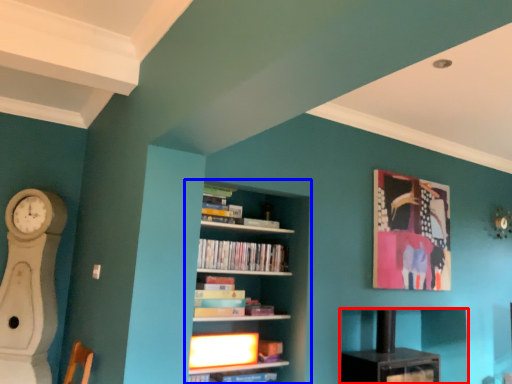
Question: Which point is closer to the camera, shelf (highlighted by a red box) or bookcase (highlighted by a blue box)?

Choices:
 (A) shelf
 (B) bookcase

Answer: (B)